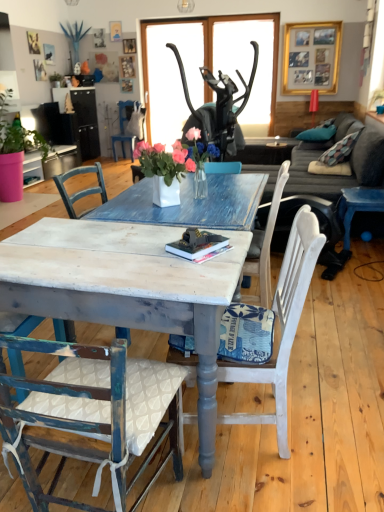
Question: Does teal fabric pillow at upper right have a lesser height compared to gold metallic picture frame at upper center?

Choices:
 (A) no
 (B) yes

Answer: (B)

Question: Is teal fabric pillow at upper right surrounding gold metallic picture frame at upper center?

Choices:
 (A) yes
 (B) no

Answer: (B)

Question: From a real-world perspective, is teal fabric pillow at upper right under gold metallic picture frame at upper center?

Choices:
 (A) no
 (B) yes

Answer: (B)

Question: From the image's perspective, does teal fabric pillow at upper right appear higher than gold metallic picture frame at upper center?

Choices:
 (A) no
 (B) yes

Answer: (A)

Question: Are teal fabric pillow at upper right and gold metallic picture frame at upper center beside each other?

Choices:
 (A) no
 (B) yes

Answer: (A)

Question: From the image's perspective, is white fabric chair at center, the second chair when ordered from back to front, above or below distressed white chair at lower left, positioned as the 2th chair in left-to-right order?

Choices:
 (A) below
 (B) above

Answer: (B)

Question: Looking at their shapes, would you say white fabric chair at center, the 4th chair in the left-to-right sequence, is wider or thinner than distressed white chair at lower left, which is the first chair in bottom-to-top order?

Choices:
 (A) wide
 (B) thin

Answer: (A)

Question: In the image, is white fabric chair at center, the second chair when ordered from back to front, on the left side or the right side of distressed white chair at lower left, which is the 3th chair from right to left?

Choices:
 (A) left
 (B) right

Answer: (B)

Question: Is point coord(264,294) positioned closer to the camera than point coord(122,465)?

Choices:
 (A) farther
 (B) closer

Answer: (A)

Question: Is point (185, 153) closer or farther from the camera than point (79, 315)?

Choices:
 (A) farther
 (B) closer

Answer: (A)

Question: From a real-world perspective, relative to distressed wood table at center, is white ceramic vase at center vertically above or below?

Choices:
 (A) below
 (B) above

Answer: (B)

Question: In terms of width, does white ceramic vase at center look wider or thinner when compared to distressed wood table at center?

Choices:
 (A) wide
 (B) thin

Answer: (B)

Question: From the image's perspective, relative to distressed wood table at center, is white ceramic vase at center above or below?

Choices:
 (A) above
 (B) below

Answer: (A)

Question: From the image's perspective, is teal fabric pillow at upper right positioned above or below gray fabric couch at center?

Choices:
 (A) above
 (B) below

Answer: (A)

Question: In terms of width, does teal fabric pillow at upper right look wider or thinner when compared to gray fabric couch at center?

Choices:
 (A) thin
 (B) wide

Answer: (A)